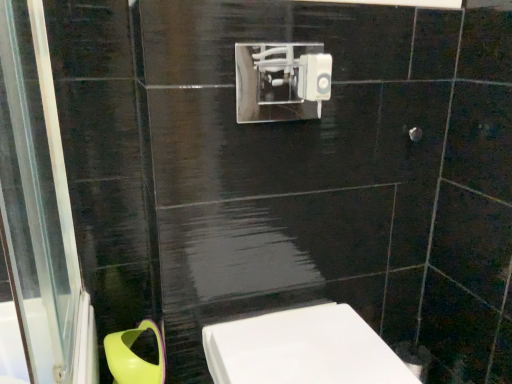
The image size is (512, 384). In order to click on white glossy toilet at lower center in this screenshot , I will do pos(302,349).

Describe the element at coordinates (302, 349) in the screenshot. I see `white glossy toilet at lower center` at that location.

The width and height of the screenshot is (512, 384). What do you see at coordinates (134, 357) in the screenshot?
I see `green plastic toilet bowl at lower left` at bounding box center [134, 357].

Where is `green plastic toilet bowl at lower left`? The height and width of the screenshot is (384, 512). green plastic toilet bowl at lower left is located at coordinates (134, 357).

The image size is (512, 384). In order to click on white glossy toilet at lower center in this screenshot , I will do `click(302, 349)`.

Which is more to the right, green plastic toilet bowl at lower left or white glossy toilet at lower center?

white glossy toilet at lower center.

Which object is further away from the camera, green plastic toilet bowl at lower left or white glossy toilet at lower center?

green plastic toilet bowl at lower left is more distant.

Which is closer, (158, 348) or (352, 373)?

Point (158, 348) appears to be farther away from the viewer than point (352, 373).

From the image's perspective, which one is positioned higher, green plastic toilet bowl at lower left or white glossy toilet at lower center?

white glossy toilet at lower center, from the image's perspective.

From a real-world perspective, which object stands above the other?

In real-world perspective, white glossy toilet at lower center is above.

Is green plastic toilet bowl at lower left wider than white glossy toilet at lower center?

In fact, green plastic toilet bowl at lower left might be narrower than white glossy toilet at lower center.

Between green plastic toilet bowl at lower left and white glossy toilet at lower center, which one has more height?

white glossy toilet at lower center is taller.

Who is smaller, green plastic toilet bowl at lower left or white glossy toilet at lower center?

With smaller size is green plastic toilet bowl at lower left.

Is green plastic toilet bowl at lower left outside of white glossy toilet at lower center?

Absolutely, green plastic toilet bowl at lower left is external to white glossy toilet at lower center.

Is there a large distance between green plastic toilet bowl at lower left and white glossy toilet at lower center?

No, there isn't a large distance between green plastic toilet bowl at lower left and white glossy toilet at lower center.

Could you tell me if green plastic toilet bowl at lower left is turned towards white glossy toilet at lower center?

No, green plastic toilet bowl at lower left is not aimed at white glossy toilet at lower center.

How many degrees apart are the facing directions of green plastic toilet bowl at lower left and white glossy toilet at lower center?

There is a 0.00045-degree angle between the facing directions of green plastic toilet bowl at lower left and white glossy toilet at lower center.

You are a GUI agent. You are given a task and a screenshot of the screen. Output one action in this format:
    pyautogui.click(x=<x>, y=<y>)
    Task: Click on the toilet bowl located behind the white glossy toilet at lower center
    This screenshot has width=512, height=384.
    Given the screenshot: What is the action you would take?
    pyautogui.click(x=134, y=357)

Which is more to the left, white glossy toilet at lower center or green plastic toilet bowl at lower left?

Positioned to the left is green plastic toilet bowl at lower left.

Between white glossy toilet at lower center and green plastic toilet bowl at lower left, which one is positioned behind?

green plastic toilet bowl at lower left is further away from the camera.

Is point (225, 382) positioned after point (112, 348)?

No, (225, 382) is closer to viewer.

From the image's perspective, is white glossy toilet at lower center above or below green plastic toilet bowl at lower left?

Based on their image positions, white glossy toilet at lower center is located above green plastic toilet bowl at lower left.

From a real-world perspective, between white glossy toilet at lower center and green plastic toilet bowl at lower left, who is vertically lower?

From a 3D spatial view, green plastic toilet bowl at lower left is below.

Which object is thinner, white glossy toilet at lower center or green plastic toilet bowl at lower left?

Thinner between the two is green plastic toilet bowl at lower left.

Which of these two, white glossy toilet at lower center or green plastic toilet bowl at lower left, stands taller?

white glossy toilet at lower center is taller.

Can you confirm if white glossy toilet at lower center is smaller than green plastic toilet bowl at lower left?

No.

Is green plastic toilet bowl at lower left located within white glossy toilet at lower center?

Definitely not — green plastic toilet bowl at lower left is not inside white glossy toilet at lower center.

Are white glossy toilet at lower center and green plastic toilet bowl at lower left located far from each other?

No, white glossy toilet at lower center is not far away from green plastic toilet bowl at lower left.

Is white glossy toilet at lower center looking in the opposite direction of green plastic toilet bowl at lower left?

No, white glossy toilet at lower center's orientation is not away from green plastic toilet bowl at lower left.

Can you tell me how much white glossy toilet at lower center and green plastic toilet bowl at lower left differ in facing direction?

The angle between the facing direction of white glossy toilet at lower center and the facing direction of green plastic toilet bowl at lower left is 0.00045 degrees.

Locate an element on the screen. toilet on the right of green plastic toilet bowl at lower left is located at coordinates (302, 349).

Find the location of `toilet above the green plastic toilet bowl at lower left (from the image's perspective)`. toilet above the green plastic toilet bowl at lower left (from the image's perspective) is located at coordinates (302, 349).

Where is `toilet bowl behind the white glossy toilet at lower center`? This screenshot has height=384, width=512. toilet bowl behind the white glossy toilet at lower center is located at coordinates (134, 357).